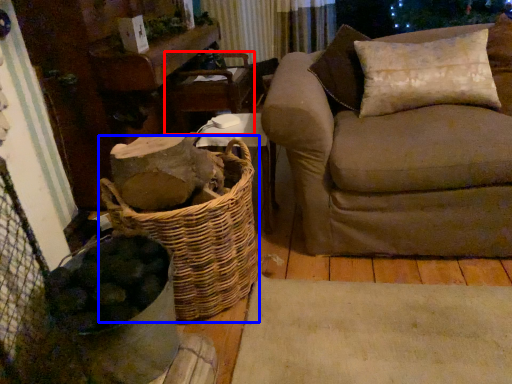
Question: Which object is further to the camera taking this photo, armchair (highlighted by a red box) or basket (highlighted by a blue box)?

Choices:
 (A) armchair
 (B) basket

Answer: (A)